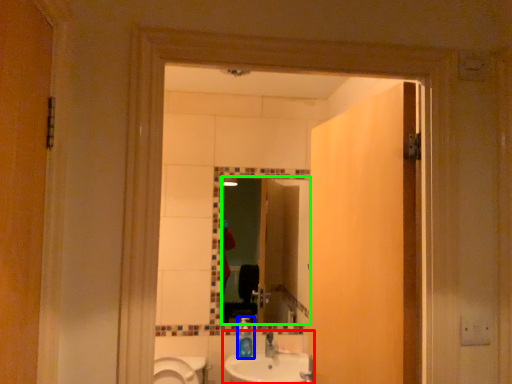
Question: Considering the real-world distances, which object is farthest from sink (highlighted by a red box)? bottle (highlighted by a blue box) or mirror (highlighted by a green box)?

Choices:
 (A) bottle
 (B) mirror

Answer: (B)